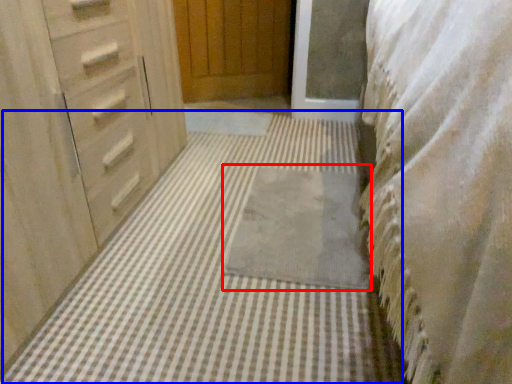
Question: Which object appears closest to the camera in this image, bath mat (highlighted by a red box) or bath mat (highlighted by a blue box)?

Choices:
 (A) bath mat
 (B) bath mat

Answer: (B)